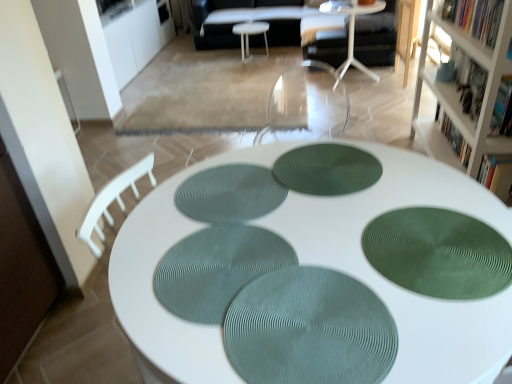
This screenshot has width=512, height=384. Identify the location of vacant area that lies between green textured placemat at center, the 4th mat from the right, and green textured placemat at center. (260, 252).